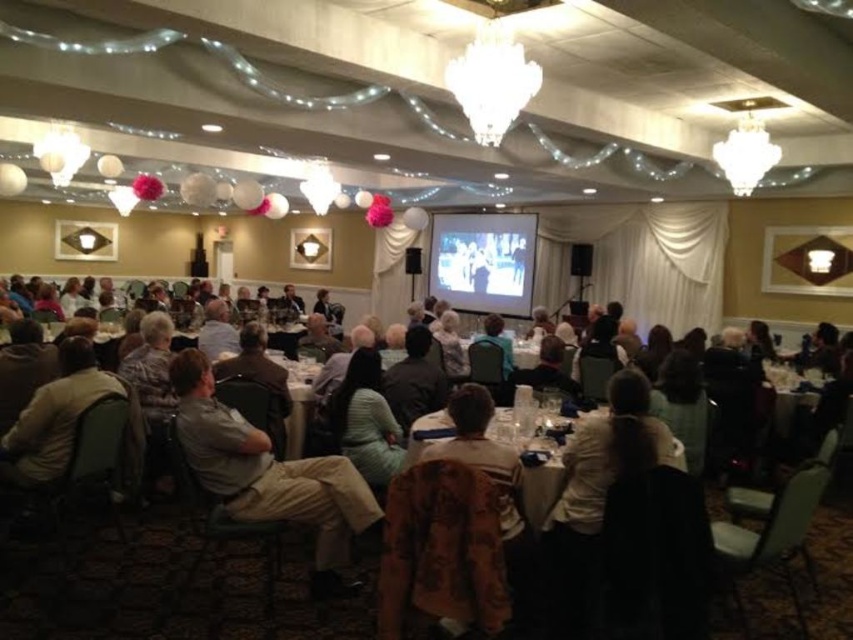
Question: Which point is closer to the camera?

Choices:
 (A) (292, 417)
 (B) (320, 506)

Answer: (B)

Question: Does light brown fabric shirt at center lie in front of white glossy table at center?

Choices:
 (A) no
 (B) yes

Answer: (B)

Question: Can you confirm if light brown fabric shirt at center is positioned above white glossy table at center?

Choices:
 (A) yes
 (B) no

Answer: (B)

Question: Which object appears farthest from the camera in this image?

Choices:
 (A) light brown fabric shirt at center
 (B) white glossy table at center

Answer: (B)

Question: Among these points, which one is farthest from the camera?

Choices:
 (A) (190, 360)
 (B) (305, 385)

Answer: (B)

Question: Is light brown fabric shirt at center wider than white glossy table at center?

Choices:
 (A) no
 (B) yes

Answer: (B)